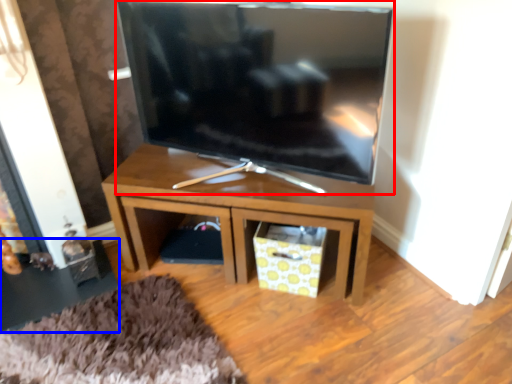
Question: Which of the following is the closest to the observer, television (highlighted by a red box) or side table (highlighted by a blue box)?

Choices:
 (A) television
 (B) side table

Answer: (A)